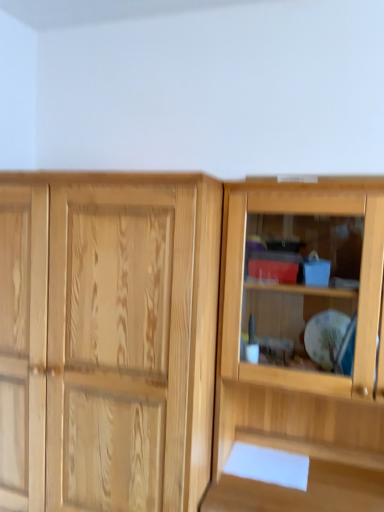
Question: From a real-world perspective, is natural wood cupboard at right on top of natural wood cabinet at left?

Choices:
 (A) no
 (B) yes

Answer: (B)

Question: Is natural wood cupboard at right turned away from natural wood cabinet at left?

Choices:
 (A) yes
 (B) no

Answer: (B)

Question: Is natural wood cabinet at left a part of natural wood cupboard at right?

Choices:
 (A) no
 (B) yes

Answer: (A)

Question: Is natural wood cupboard at right further to the viewer compared to natural wood cabinet at left?

Choices:
 (A) yes
 (B) no

Answer: (B)

Question: Can you confirm if natural wood cupboard at right is thinner than natural wood cabinet at left?

Choices:
 (A) no
 (B) yes

Answer: (B)

Question: Would you say natural wood cupboard at right is a long distance from natural wood cabinet at left?

Choices:
 (A) yes
 (B) no

Answer: (B)

Question: From the image's perspective, does natural wood cabinet at left appear lower than natural wood cupboard at right?

Choices:
 (A) no
 (B) yes

Answer: (B)

Question: From a real-world perspective, is natural wood cabinet at left positioned over natural wood cupboard at right based on gravity?

Choices:
 (A) yes
 (B) no

Answer: (B)

Question: Is natural wood cabinet at left directly adjacent to natural wood cupboard at right?

Choices:
 (A) no
 (B) yes

Answer: (A)

Question: From a real-world perspective, is natural wood cabinet at left beneath natural wood cupboard at right?

Choices:
 (A) no
 (B) yes

Answer: (B)

Question: Is the depth of natural wood cabinet at left greater than that of natural wood cupboard at right?

Choices:
 (A) yes
 (B) no

Answer: (A)

Question: Would you say natural wood cabinet at left is outside natural wood cupboard at right?

Choices:
 (A) no
 (B) yes

Answer: (B)

Question: Considering the positions of natural wood cupboard at right and natural wood cabinet at left in the image, is natural wood cupboard at right taller or shorter than natural wood cabinet at left?

Choices:
 (A) short
 (B) tall

Answer: (A)